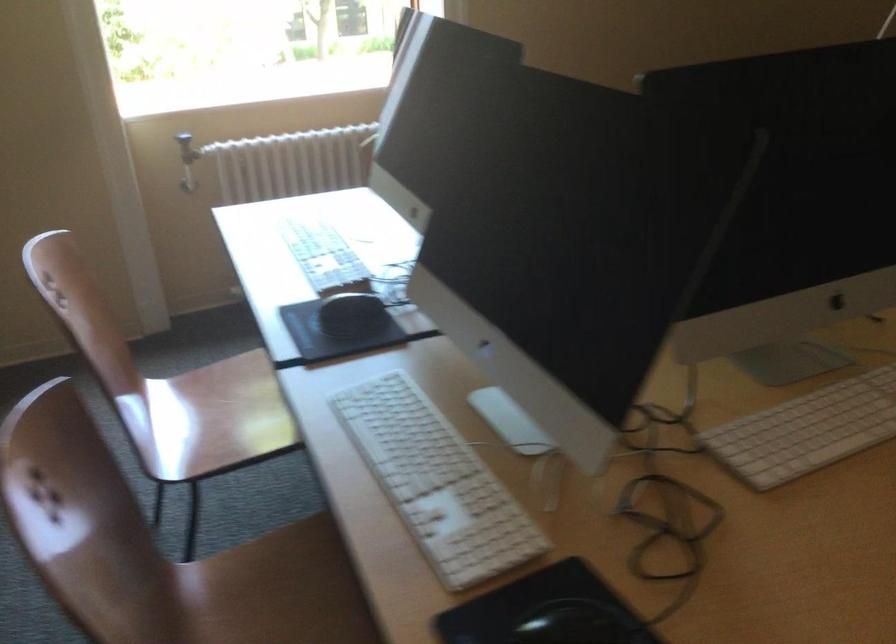
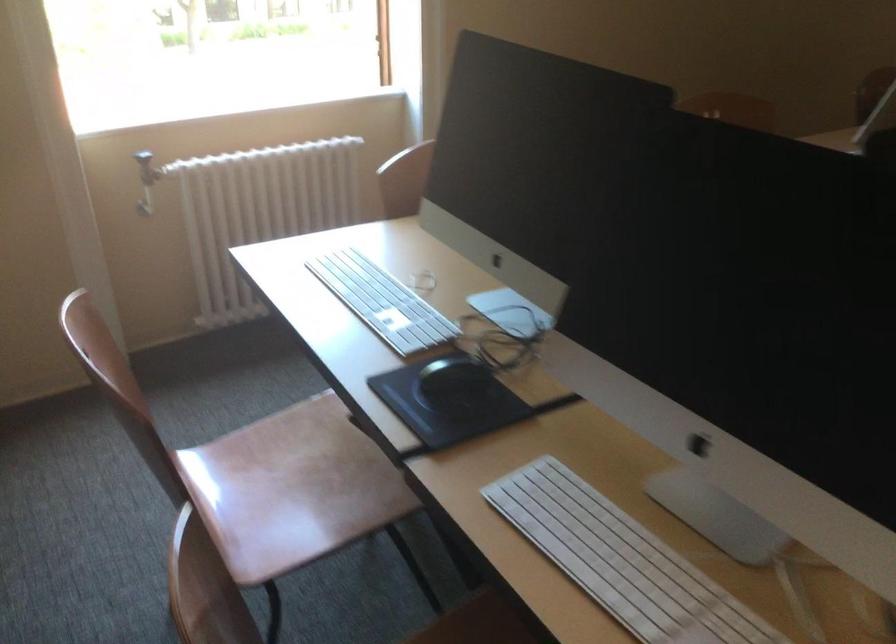
Find the pixel in the second image that matches point (415, 447) in the first image.

(622, 561)